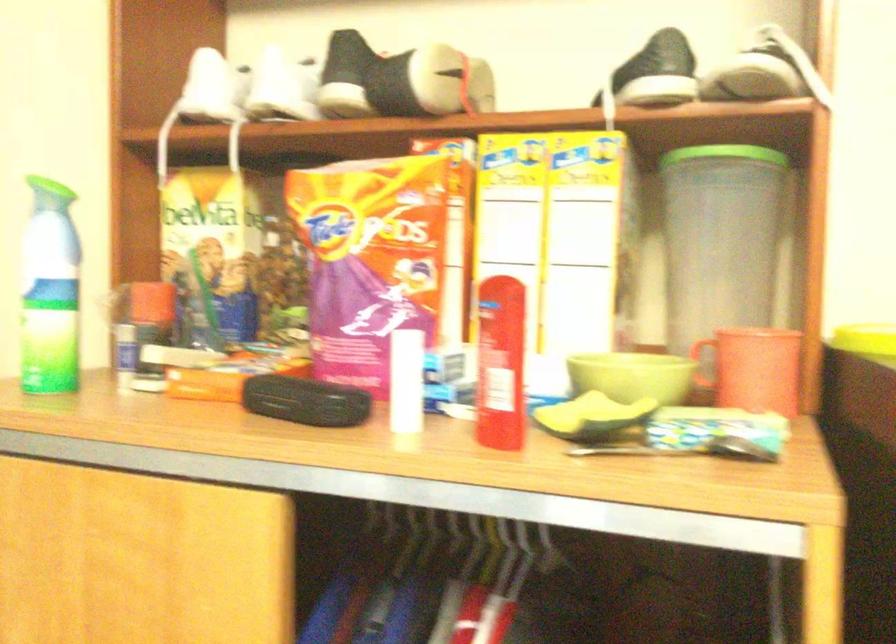
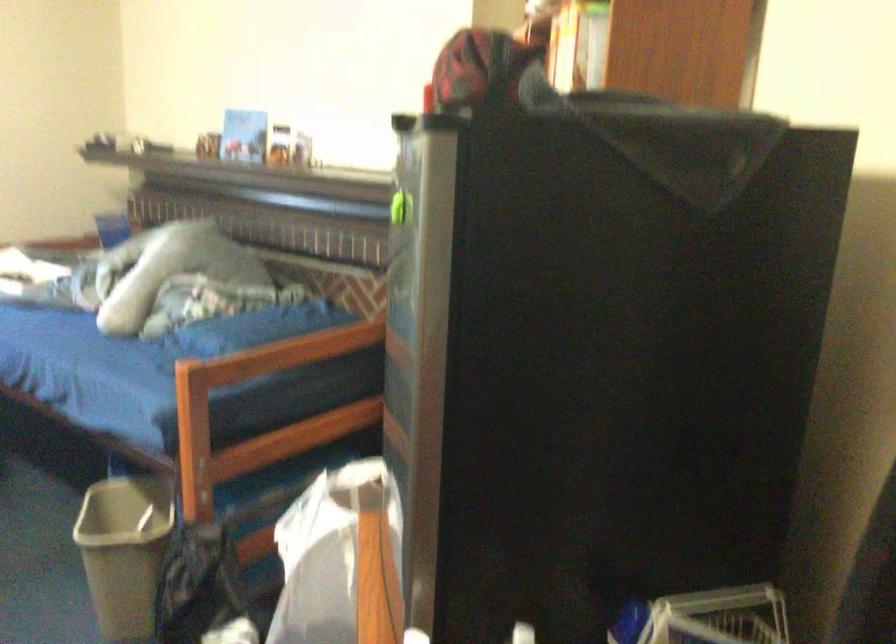
Question: I am providing you with two images of the same scene from different viewpoints. After the viewpoint changes to image2, which objects are now occluded?

Choices:
 (A) wooden coat rack stick
 (B) red and black cap
 (C) grey trash can
 (D) light green bowl

Answer: (D)